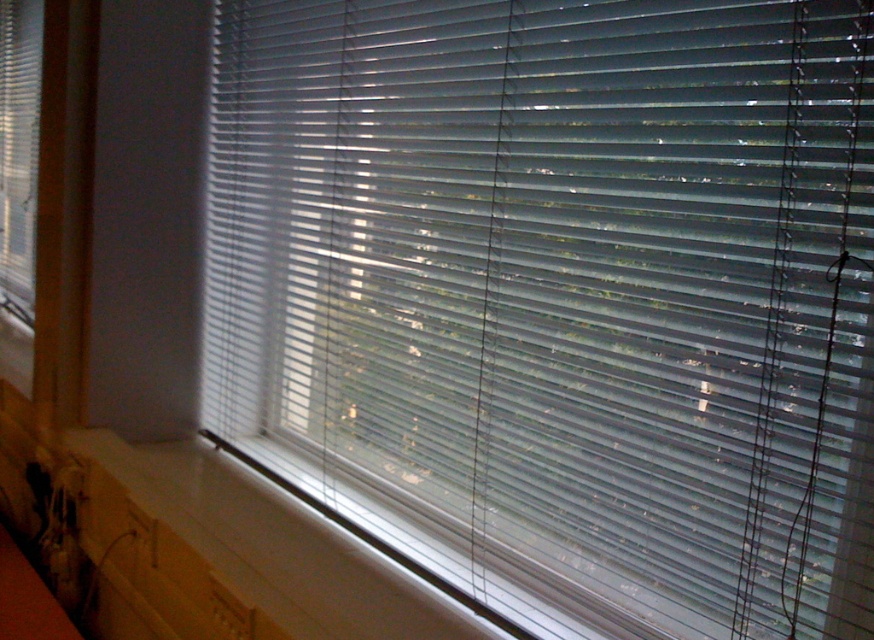
You are placing a small potted plant on the white plastic window sill at lower center. If you want to ensure the plant gets maximum sunlight, where should you place it relative to the clear plastic blinds at left?

The white plastic window sill at lower center is closer to the viewer than the clear plastic blinds at left. Therefore, placing the potted plant on the white plastic window sill at lower center will position it closer to the light source coming through the window, maximizing sunlight exposure.

You are organizing a small potted plant and want to place it on the white plastic window sill at lower center or the clear plastic blinds at left. Which surface can accommodate the plant without overcrowding?

The clear plastic blinds at left can accommodate the plant without overcrowding because the white plastic window sill at lower center occupies less space than the clear plastic blinds at left.

You are a delivery robot with a box that is 38 inches long. You need to place the box on a surface near the clear plastic blinds at left. Is there enough space on the white plastic window sill at lower center to place the box without it hanging off the edge?

The white plastic window sill at lower center is 37.54 inches away from clear plastic blinds at left. Since the box is 38 inches long, it is slightly longer than the available space, so the box would hang off the edge if placed there.